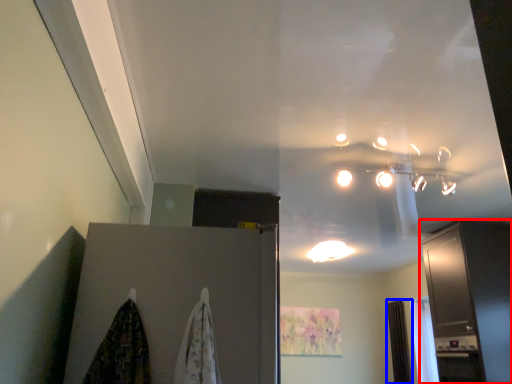
Question: Which point is closer to the camera, cabinetry (highlighted by a red box) or curtain (highlighted by a blue box)?

Choices:
 (A) cabinetry
 (B) curtain

Answer: (A)